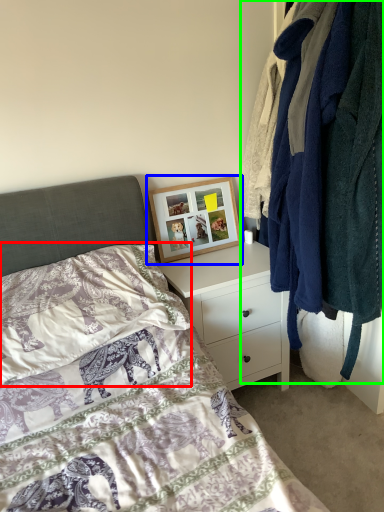
Question: Which object is the closest to the pillow (highlighted by a red box)? Choose among these: picture frame (highlighted by a blue box) or closet (highlighted by a green box).

Choices:
 (A) picture frame
 (B) closet

Answer: (A)